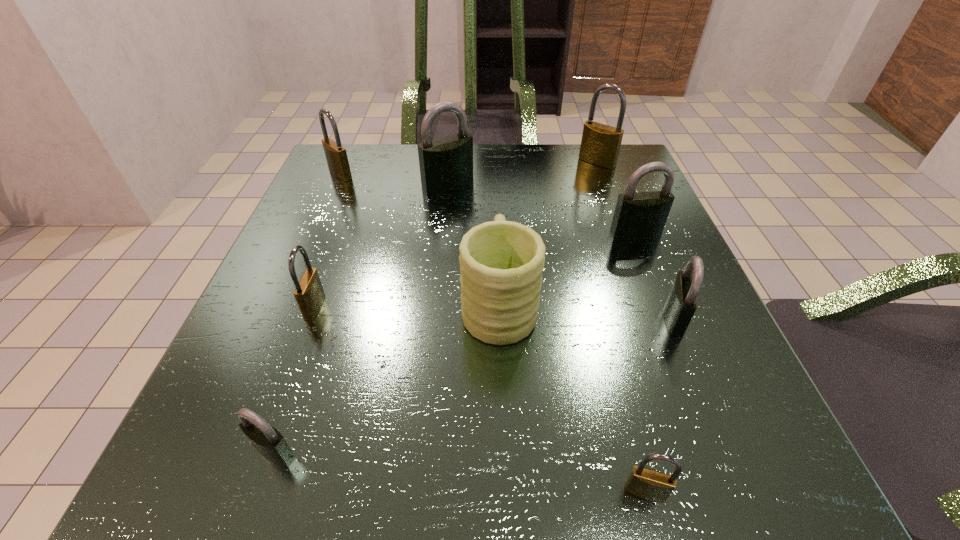
The width and height of the screenshot is (960, 540). I want to click on the biggest brass padlock, so pos(600,145).

I want to click on the farthest black padlock, so click(445, 163).

Where is `the biggest black padlock`? This screenshot has width=960, height=540. the biggest black padlock is located at coordinates (445, 163).

The height and width of the screenshot is (540, 960). I want to click on the leftmost padlock, so click(336, 156).

Where is `the leftmost brass padlock`? This screenshot has height=540, width=960. the leftmost brass padlock is located at coordinates (336, 156).

Identify the location of the second biggest black padlock. The image size is (960, 540). [641, 215].

This screenshot has height=540, width=960. I want to click on the third nearest black padlock, so click(641, 215).

Identify the location of green mug. Image resolution: width=960 pixels, height=540 pixels. (501, 262).

You are a GUI agent. You are given a task and a screenshot of the screen. Output one action in this format:
    pyautogui.click(x=<x>, y=<y>)
    Task: Click on the third biggest brass padlock
    
    Given the screenshot: What is the action you would take?
    pyautogui.click(x=309, y=294)

Find the location of a particular element. The image size is (960, 540). the second nearest brass padlock is located at coordinates (309, 294).